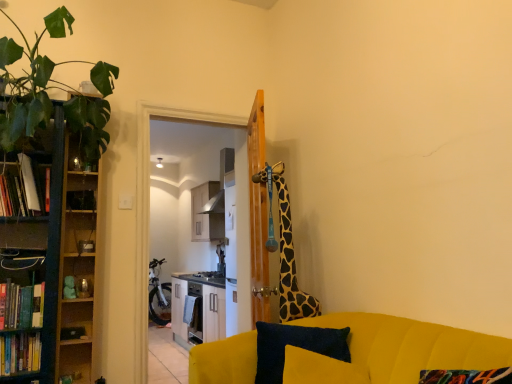
Question: Would you say white glossy cabinet at center is part of green leafy plant at left's contents?

Choices:
 (A) yes
 (B) no

Answer: (B)

Question: Can you see green leafy plant at left touching white glossy cabinet at center?

Choices:
 (A) no
 (B) yes

Answer: (A)

Question: Considering the relative sizes of green leafy plant at left and white glossy cabinet at center in the image provided, is green leafy plant at left thinner than white glossy cabinet at center?

Choices:
 (A) no
 (B) yes

Answer: (A)

Question: From the image's perspective, is green leafy plant at left under white glossy cabinet at center?

Choices:
 (A) no
 (B) yes

Answer: (A)

Question: Is green leafy plant at left aimed at white glossy cabinet at center?

Choices:
 (A) yes
 (B) no

Answer: (B)

Question: Is green leafy plant at left taller than white glossy cabinet at center?

Choices:
 (A) yes
 (B) no

Answer: (B)

Question: Is velvet yellow couch at lower right positioned behind velvet dark blue pillow at lower center?

Choices:
 (A) no
 (B) yes

Answer: (A)

Question: From the image's perspective, is velvet yellow couch at lower right under velvet dark blue pillow at lower center?

Choices:
 (A) no
 (B) yes

Answer: (B)

Question: Would you consider velvet yellow couch at lower right to be distant from velvet dark blue pillow at lower center?

Choices:
 (A) no
 (B) yes

Answer: (A)

Question: Could you tell me if velvet yellow couch at lower right is facing velvet dark blue pillow at lower center?

Choices:
 (A) yes
 (B) no

Answer: (A)

Question: Does velvet yellow couch at lower right have a smaller size compared to velvet dark blue pillow at lower center?

Choices:
 (A) no
 (B) yes

Answer: (A)

Question: From a real-world perspective, is velvet yellow couch at lower right on velvet dark blue pillow at lower center?

Choices:
 (A) yes
 (B) no

Answer: (B)

Question: Does wooden shelf at left come behind hardcover book at left, the second book positioned from the bottom?

Choices:
 (A) no
 (B) yes

Answer: (B)